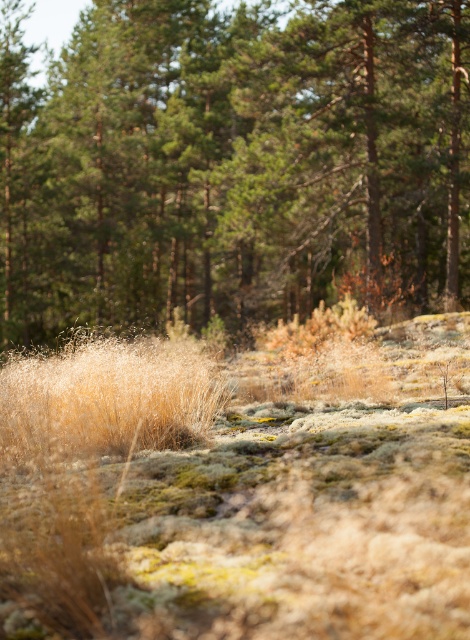
You are standing in the forest scene described. You want to place a small wooden bench exactly at the center of the image. Is the green textured pine forest at center located at the center of the image?

The green textured pine forest at center is positioned at coordinates point (x=235, y=164), which is not exactly at the center of the image. The center would be at point (x=235, y=320). Therefore, the bench placed at the center would not align with the green textured pine forest at center.

You are a hiker trying to navigate through the forest. You see the dry grass at lower left and the green textured pine forest at center. Which one is closer to you?

The green textured pine forest at center is closer to you because the dry grass at lower left is positioned behind it.